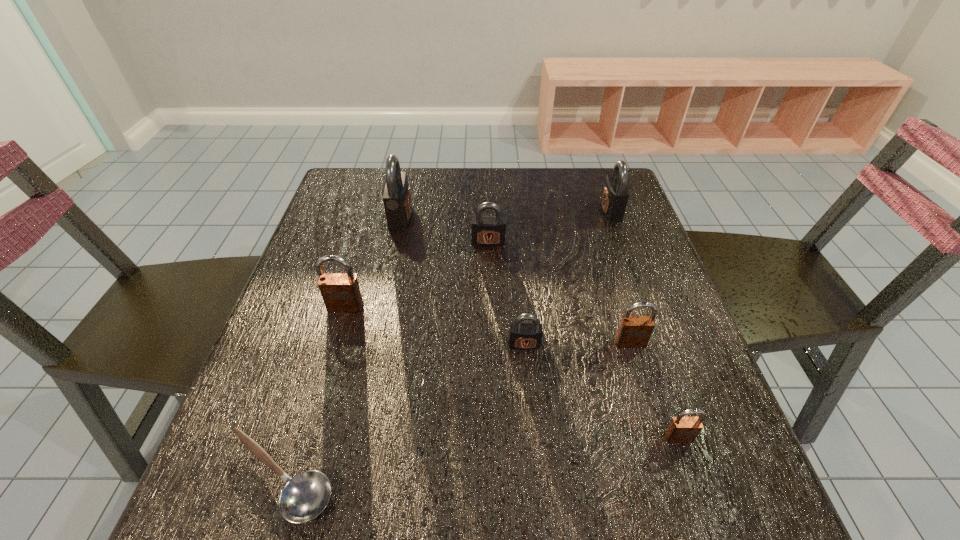
This screenshot has height=540, width=960. What are the coordinates of `free space located 0.130m on the front of the smallest gray padlock near the keyhole` in the screenshot? It's located at (530, 410).

Identify the location of vacant space located on the front-facing side of the nearest padlock. (702, 506).

Identify the location of free location located on the right of the ladle. (502, 476).

The image size is (960, 540). Find the location of `object present at the near edge`. object present at the near edge is located at coordinates (305, 496).

I want to click on padlock located at the left edge, so 341,293.

Where is `ladle present at the left edge`? The image size is (960, 540). ladle present at the left edge is located at coordinates (305, 496).

This screenshot has width=960, height=540. What are the coordinates of `object located at the near left corner` in the screenshot? It's located at (305, 496).

At what (x,y) coordinates should I click in order to perform the action: click on object situated at the far right corner. Please return your answer as a coordinate pair (x, y). Image resolution: width=960 pixels, height=540 pixels. Looking at the image, I should click on (615, 195).

At what (x,y) coordinates should I click in order to perform the action: click on free space at the far edge of the desktop. Please return your answer as a coordinate pair (x, y). Looking at the image, I should click on (505, 198).

In the image, there is a desktop. At what (x,y) coordinates should I click in order to perform the action: click on free space at the near edge. Please return your answer as a coordinate pair (x, y). Image resolution: width=960 pixels, height=540 pixels. Looking at the image, I should click on (460, 502).